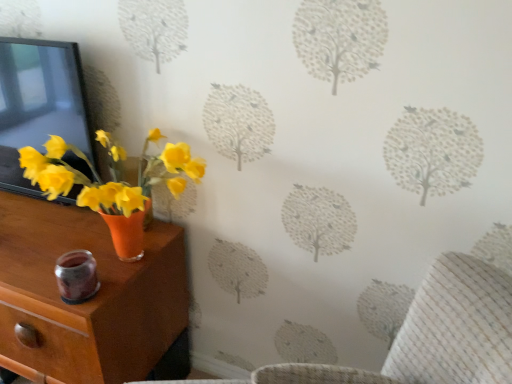
Question: Is orange matte vase at left positioned with its back to matte black picture frame at left?

Choices:
 (A) no
 (B) yes

Answer: (A)

Question: Is matte black picture frame at left a part of orange matte vase at left?

Choices:
 (A) no
 (B) yes

Answer: (A)

Question: Is orange matte vase at left further to camera compared to matte black picture frame at left?

Choices:
 (A) no
 (B) yes

Answer: (A)

Question: Is the depth of orange matte vase at left less than that of matte black picture frame at left?

Choices:
 (A) yes
 (B) no

Answer: (A)

Question: From a real-world perspective, is orange matte vase at left below matte black picture frame at left?

Choices:
 (A) no
 (B) yes

Answer: (B)

Question: Considering the relative positions of orange matte vase at left and matte black picture frame at left in the image provided, is orange matte vase at left to the right of matte black picture frame at left from the viewer's perspective?

Choices:
 (A) yes
 (B) no

Answer: (B)

Question: Is matte black picture frame at left surrounding orange matte vase at left?

Choices:
 (A) no
 (B) yes

Answer: (A)

Question: Is matte black picture frame at left closer to the viewer compared to orange matte vase at left?

Choices:
 (A) yes
 (B) no

Answer: (B)

Question: From a real-world perspective, is matte black picture frame at left under orange matte vase at left?

Choices:
 (A) no
 (B) yes

Answer: (A)

Question: From the image's perspective, is matte black picture frame at left on top of orange matte vase at left?

Choices:
 (A) no
 (B) yes

Answer: (B)

Question: Does matte black picture frame at left have a smaller size compared to orange matte vase at left?

Choices:
 (A) yes
 (B) no

Answer: (A)

Question: Is matte black picture frame at left outside of orange matte vase at left?

Choices:
 (A) yes
 (B) no

Answer: (A)

Question: Considering the positions of orange matte vase at left and matte black picture frame at left in the image, is orange matte vase at left bigger or smaller than matte black picture frame at left?

Choices:
 (A) small
 (B) big

Answer: (B)